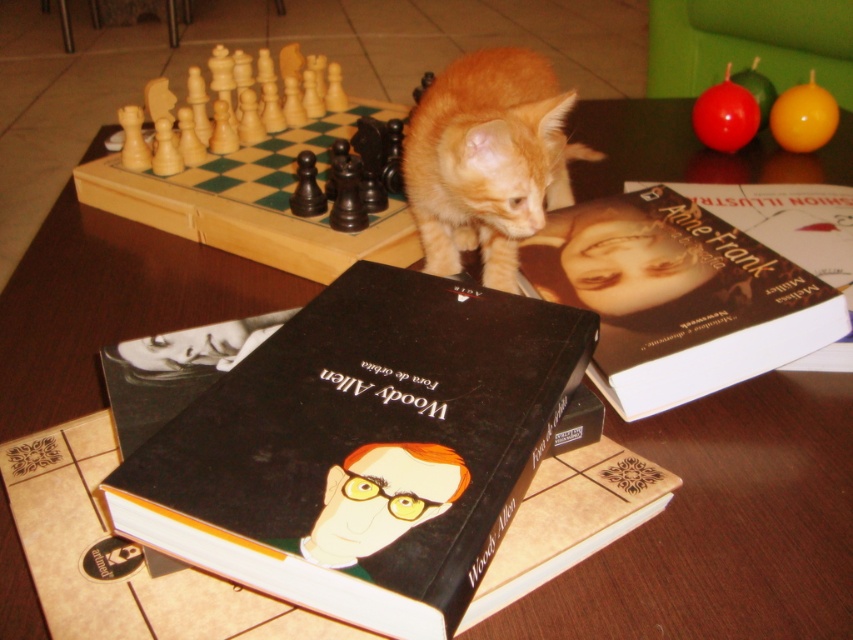
Which is in front, point (820, 342) or point (503, 208)?

Positioned in front is point (820, 342).

Can you confirm if hardcover book at upper right is taller than orange fur cat at center?

In fact, hardcover book at upper right may be shorter than orange fur cat at center.

What do you see at coordinates (676, 298) in the screenshot? I see `hardcover book at upper right` at bounding box center [676, 298].

In order to click on hardcover book at upper right in this screenshot , I will do `click(676, 298)`.

Is hardcover book at upper right positioned at the back of light wood chess set at upper left?

No.

Where is `hardcover book at upper right`? This screenshot has width=853, height=640. hardcover book at upper right is located at coordinates (676, 298).

Find the location of a particular element. This screenshot has width=853, height=640. hardcover book at upper right is located at coordinates (676, 298).

At what (x,y) coordinates should I click in order to perform the action: click on hardcover book at upper right. Please return your answer as a coordinate pair (x, y). Looking at the image, I should click on (676, 298).

Based on the photo, who is higher up, orange fur cat at center or light wood chess set at upper left?

light wood chess set at upper left is above.

Is orange fur cat at center above light wood chess set at upper left?

Incorrect, orange fur cat at center is not positioned above light wood chess set at upper left.

Which is in front, point (488, 156) or point (231, 204)?

Point (488, 156)

This screenshot has width=853, height=640. Find the location of `orange fur cat at center`. orange fur cat at center is located at coordinates (486, 160).